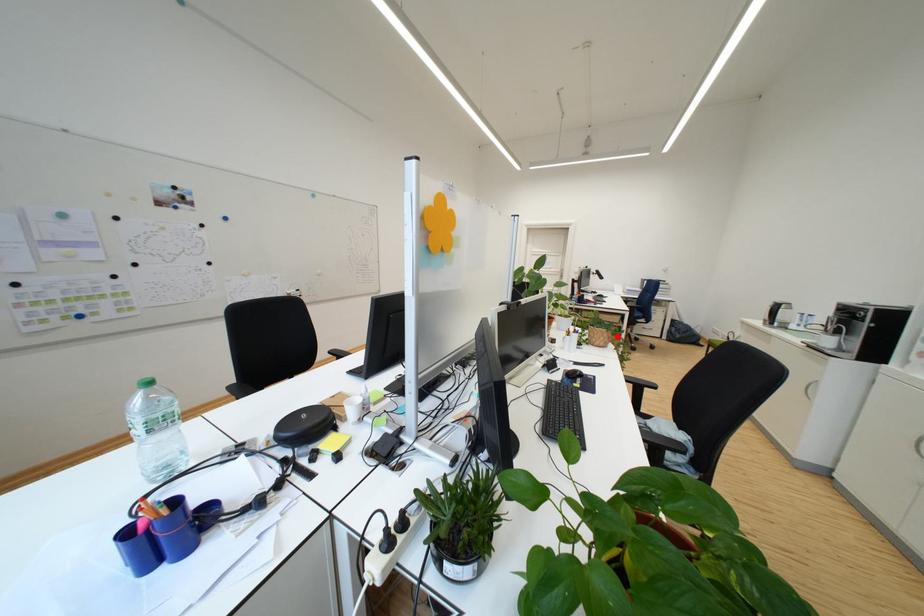
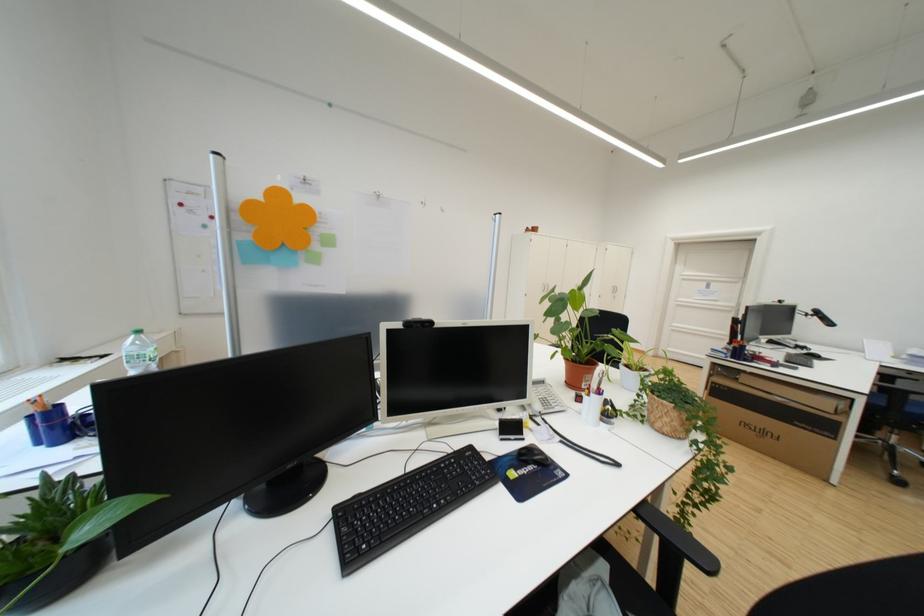
Question: I am providing you with two images of the same scene from different viewpoints. A red point is marked on the first image. Is the red point's position out of view in image 2?

Choices:
 (A) Yes
 (B) No

Answer: (B)